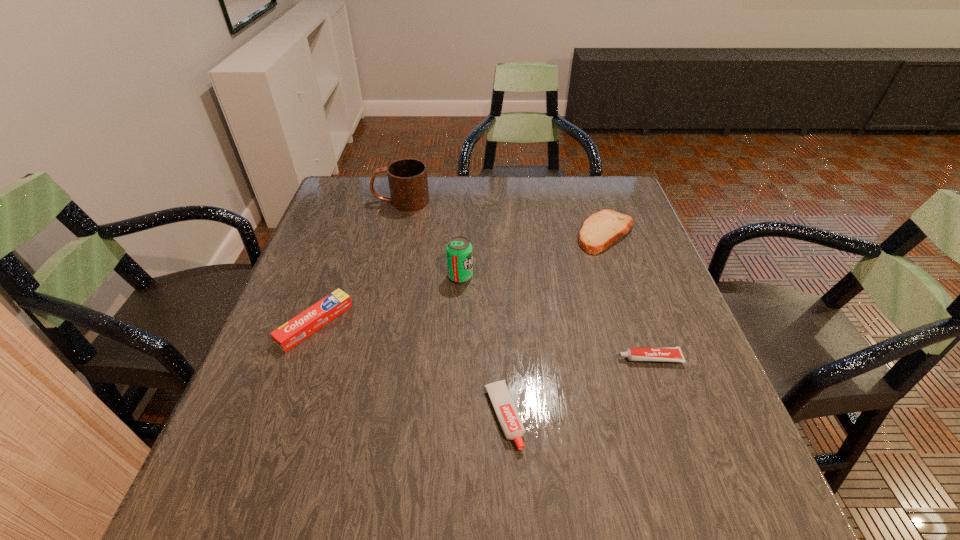
Identify which object is the closest to the leftmost toothpaste. Please provide its 2D coordinates. Your answer should be formatted as a tuple, i.e. [(x, y)], where the tuple contains the x and y coordinates of a point satisfying the conditions above.

[(459, 250)]

Locate an element on the screen. This screenshot has width=960, height=540. object that ranks as the closest to the pop soda is located at coordinates (294, 331).

Image resolution: width=960 pixels, height=540 pixels. What are the coordinates of `toothpaste that stands as the second closest to the pita bread` in the screenshot? It's located at (505, 409).

Identify which toothpaste is located as the nearest to the rightmost toothpaste. Please provide its 2D coordinates. Your answer should be formatted as a tuple, i.e. [(x, y)], where the tuple contains the x and y coordinates of a point satisfying the conditions above.

[(505, 409)]

Where is `blank area in the image that satisfies the following two spatial constraints: 1. on the front side of the leftmost toothpaste; 2. on the right side of the nearest object`? blank area in the image that satisfies the following two spatial constraints: 1. on the front side of the leftmost toothpaste; 2. on the right side of the nearest object is located at coordinates (281, 416).

This screenshot has width=960, height=540. What are the coordinates of `vacant area that satisfies the following two spatial constraints: 1. on the front side of the nearest toothpaste; 2. on the right side of the leftmost toothpaste` in the screenshot? It's located at (281, 416).

This screenshot has height=540, width=960. Find the location of `vacant area that satisfies the following two spatial constraints: 1. on the side of the pita bread with the handle; 2. on the left side of the mug`. vacant area that satisfies the following two spatial constraints: 1. on the side of the pita bread with the handle; 2. on the left side of the mug is located at coordinates (394, 234).

Find the location of `blank space that satisfies the following two spatial constraints: 1. on the side of the mug with the handle; 2. on the front side of the leftmost toothpaste`. blank space that satisfies the following two spatial constraints: 1. on the side of the mug with the handle; 2. on the front side of the leftmost toothpaste is located at coordinates (372, 323).

Where is `blank space that satisfies the following two spatial constraints: 1. on the side of the farthest object with the handle; 2. on the right side of the nearest object`? The image size is (960, 540). blank space that satisfies the following two spatial constraints: 1. on the side of the farthest object with the handle; 2. on the right side of the nearest object is located at coordinates (350, 416).

Find the location of a particular element. The image size is (960, 540). vacant space that satisfies the following two spatial constraints: 1. on the back side of the third object from right to left; 2. on the right side of the pita bread is located at coordinates (496, 234).